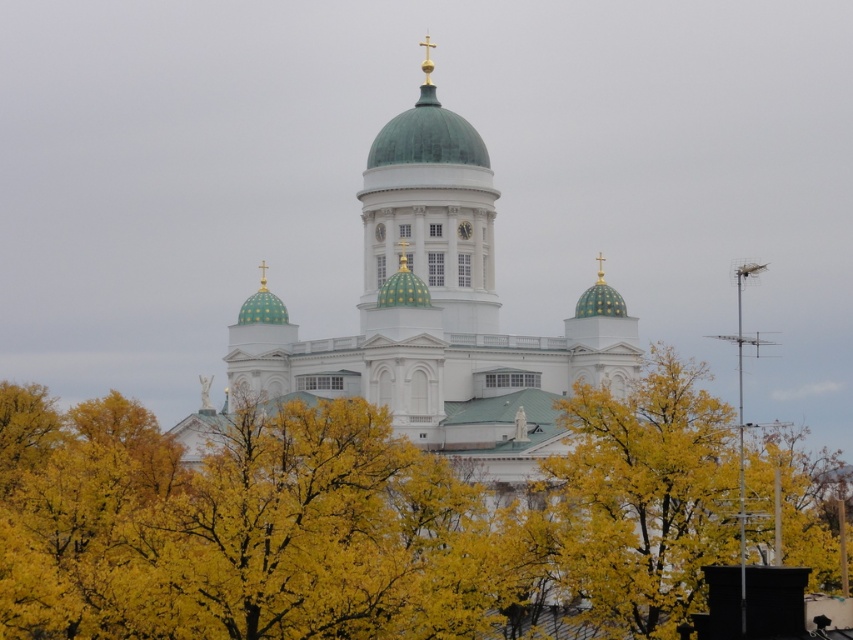
You are standing in a park and see the yellow leafy tree at center. If you want to take a closer look at the cathedral behind it, should you move forward or backward?

Since the yellow leafy tree at center is 84.11 meters away from the viewer, moving forward would bring you closer to the tree, potentially blocking your view of the cathedral. Moving backward would create more space between you and the tree, allowing you to see the cathedral behind it better. Therefore, you should move backward to get a clearer view of the cathedral behind the yellow leafy tree at center.